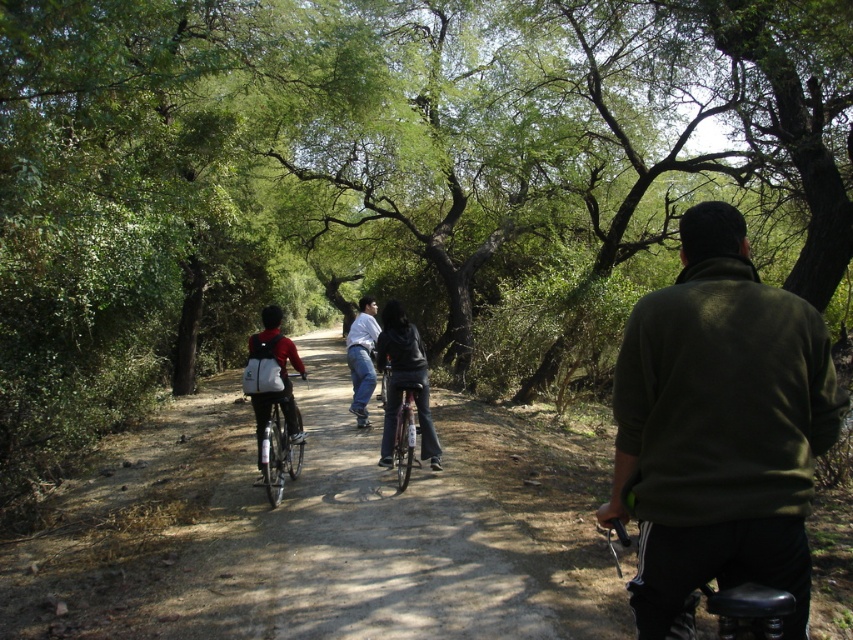
You are a photographer trying to capture a candid shot of the matte black jacket at center and the metallic silver bicycle at center. Since you want to focus on the jacket, which object should you adjust your camera to prioritize in the frame?

The matte black jacket at center is located above the metallic silver bicycle at center, so you should adjust your camera to prioritize the matte black jacket at center in the frame since it is positioned higher.

You are a photographer standing at the origin point of the coordinate system. You want to take a photo of the matte black jacket at center. What are the coordinates where you should aim your camera?

The coordinates to aim your camera are at point [404,381], which is where the matte black jacket at center is located.